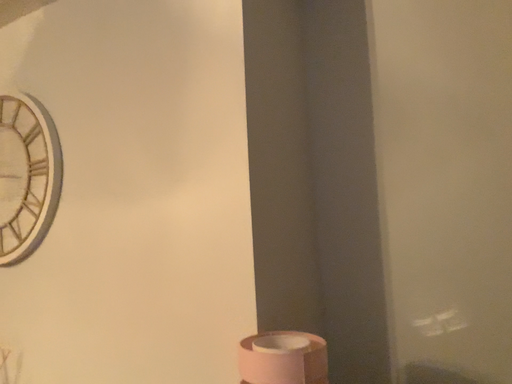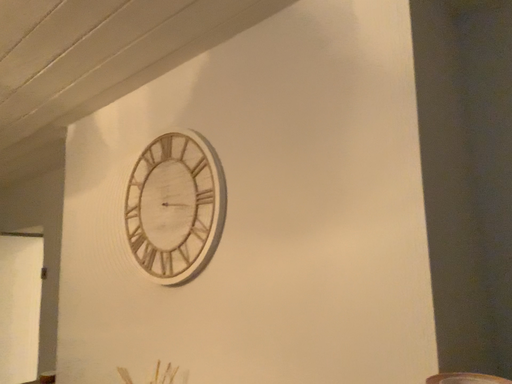
Question: Which way did the camera rotate in the video?

Choices:
 (A) rotated right
 (B) rotated left

Answer: (B)